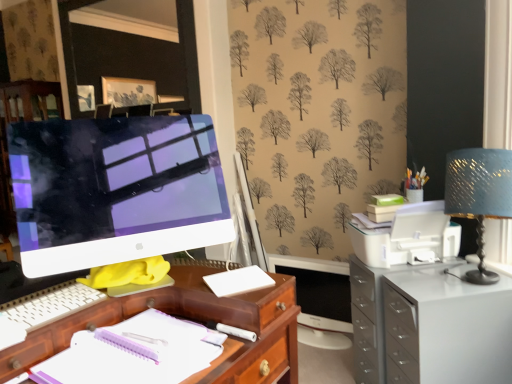
Locate an element on the screen. blank space above white paper notebook at center (from a real-world perspective) is located at coordinates (118, 341).